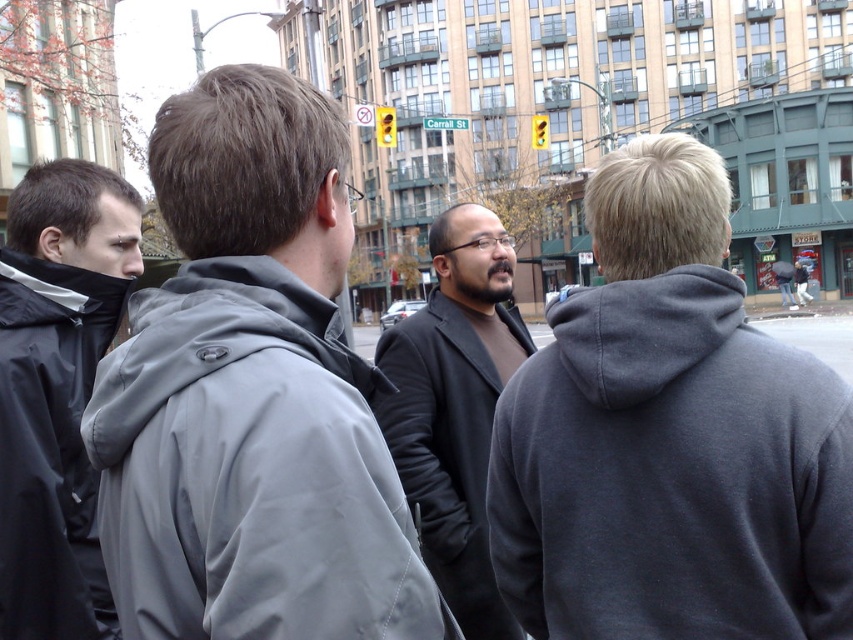
Based on the photo, which of these two, dark gray hoodie at right or dark gray hoodie at center, stands taller?

With more height is dark gray hoodie at right.

Does dark gray hoodie at right have a smaller size compared to dark gray hoodie at center?

Incorrect, dark gray hoodie at right is not smaller in size than dark gray hoodie at center.

You are a GUI agent. You are given a task and a screenshot of the screen. Output one action in this format:
    pyautogui.click(x=<x>, y=<y>)
    Task: Click on the dark gray hoodie at right
    This screenshot has width=853, height=640.
    Given the screenshot: What is the action you would take?
    pyautogui.click(x=669, y=436)

The image size is (853, 640). Find the location of `dark gray hoodie at right`. dark gray hoodie at right is located at coordinates (669, 436).

Between gray synthetic jacket at upper left and dark gray hoodie at center, which one is positioned higher?

dark gray hoodie at center is above.

Describe the element at coordinates (250, 468) in the screenshot. I see `gray synthetic jacket at upper left` at that location.

Which is behind, point (241, 573) or point (792, 264)?

The point (792, 264) is more distant.

The width and height of the screenshot is (853, 640). I want to click on gray synthetic jacket at upper left, so click(x=250, y=468).

Can you confirm if dark gray coat at center is positioned to the left of dark gray hoodie at center?

Correct, you'll find dark gray coat at center to the left of dark gray hoodie at center.

This screenshot has width=853, height=640. Describe the element at coordinates (456, 406) in the screenshot. I see `dark gray coat at center` at that location.

Where is `dark gray coat at center`? The height and width of the screenshot is (640, 853). dark gray coat at center is located at coordinates (456, 406).

Identify the location of dark gray coat at center. This screenshot has height=640, width=853. (456, 406).